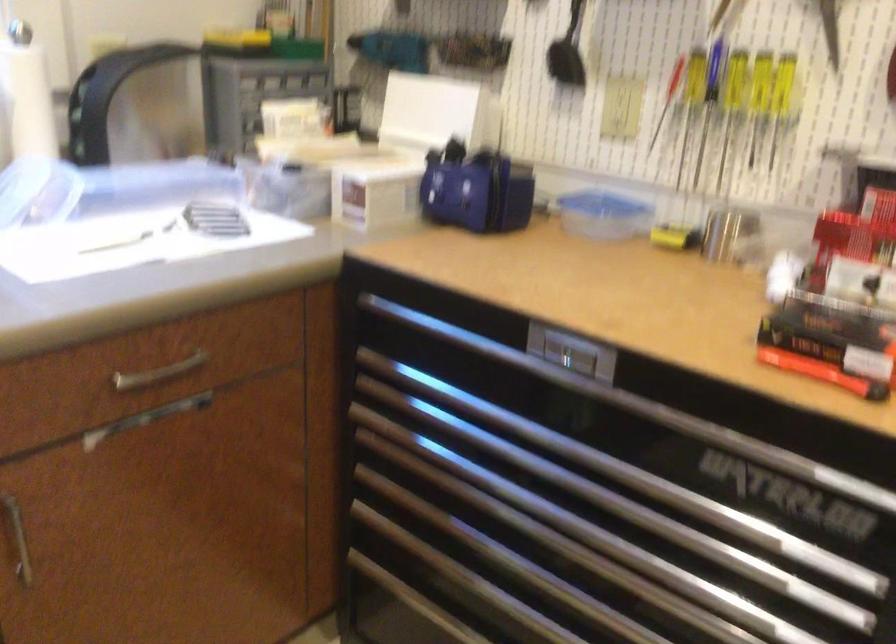
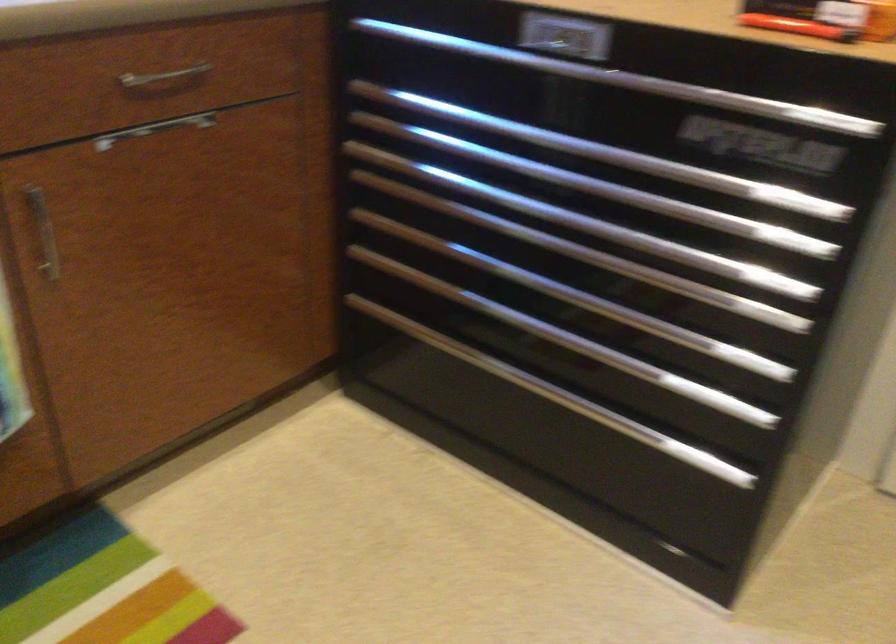
Where in the second image is the point corresponding to point 592,456 from the first image?

(580, 144)